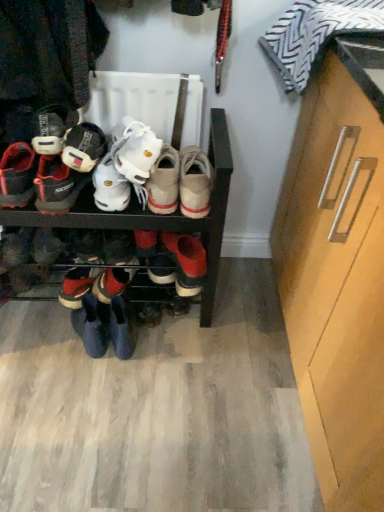
The width and height of the screenshot is (384, 512). What do you see at coordinates (51, 129) in the screenshot? I see `matte black shoe at left, which is counted as the 2th footwear, starting from the left` at bounding box center [51, 129].

The width and height of the screenshot is (384, 512). Describe the element at coordinates (315, 34) in the screenshot. I see `striped fabric pillow at upper right` at that location.

In order to face white suede sneakers at center, acting as the second footwear starting from the right, should I rotate leftwards or rightwards?

Turn left by 3.628 degrees to look at white suede sneakers at center, acting as the second footwear starting from the right.

Describe the element at coordinates (195, 183) in the screenshot. I see `light brown suede shoe at center, the 1th footwear when ordered from right to left` at that location.

Locate an element on the screen. light brown wood cabinet at right is located at coordinates (336, 283).

Image resolution: width=384 pixels, height=512 pixels. In order to click on matte black sneakers at left, arranged as the first footwear when viewed from the left in this screenshot , I will do `click(17, 175)`.

Is light brown suede shoe at center, the 1th footwear when ordered from right to left, facing towards matte black shoe at left, which is counted as the 2th footwear, starting from the left?

No, light brown suede shoe at center, the 1th footwear when ordered from right to left, is not aimed at matte black shoe at left, which is counted as the 2th footwear, starting from the left.

From a real-world perspective, count 2nd footwears downward from the matte black shoe at left, arranged as the 5th footwear when viewed from the right, and point to it. Please provide its 2D coordinates.

[(195, 183)]

Can you confirm if light brown suede shoe at center, the 1th footwear when ordered from right to left, is thinner than matte black shoe at left, arranged as the 5th footwear when viewed from the right?

No, light brown suede shoe at center, the 1th footwear when ordered from right to left, is not thinner than matte black shoe at left, arranged as the 5th footwear when viewed from the right.

From a real-world perspective, who is located lower, light brown suede shoe at center, the 1th footwear when ordered from right to left, or matte black shoe at left, which is counted as the 2th footwear, starting from the left?

light brown suede shoe at center, the 1th footwear when ordered from right to left.

From the image's perspective, which one is positioned lower, light brown wood cabinet at right or black matte shoe rack at center?

light brown wood cabinet at right appears lower in the image.

Is light brown wood cabinet at right positioned beyond the bounds of black matte shoe rack at center?

A: Absolutely, light brown wood cabinet at right is external to black matte shoe rack at center.

Can you confirm if light brown wood cabinet at right is positioned to the right of black matte shoe rack at center?

Correct, you'll find light brown wood cabinet at right to the right of black matte shoe rack at center.

Looking at the image, does matte black shoe at left, arranged as the 5th footwear when viewed from the right, seem bigger or smaller compared to light brown suede shoe at center, the 1th footwear when ordered from right to left?

Considering their sizes, matte black shoe at left, arranged as the 5th footwear when viewed from the right, takes up less space than light brown suede shoe at center, the 1th footwear when ordered from right to left.

Based on their positions, is matte black shoe at left, arranged as the 5th footwear when viewed from the right, located to the left or right of light brown suede shoe at center, positioned as the sixth footwear in left-to-right order?

Clearly, matte black shoe at left, arranged as the 5th footwear when viewed from the right, is on the left of light brown suede shoe at center, positioned as the sixth footwear in left-to-right order, in the image.

Is the depth of matte black shoe at left, arranged as the 5th footwear when viewed from the right, less than that of light brown suede shoe at center, positioned as the sixth footwear in left-to-right order?

Yes, matte black shoe at left, arranged as the 5th footwear when viewed from the right, is closer to the viewer.

Is striped fabric pillow at upper right at the left side of matte black shoe at left, which is counted as the 2th footwear, starting from the left?

Incorrect, striped fabric pillow at upper right is not on the left side of matte black shoe at left, which is counted as the 2th footwear, starting from the left.

From a real-world perspective, between striped fabric pillow at upper right and matte black shoe at left, arranged as the 5th footwear when viewed from the right, who is vertically lower?

matte black shoe at left, arranged as the 5th footwear when viewed from the right.

How different are the orientations of striped fabric pillow at upper right and matte black shoe at left, arranged as the 5th footwear when viewed from the right, in degrees?

92.1 degrees separate the facing orientations of striped fabric pillow at upper right and matte black shoe at left, arranged as the 5th footwear when viewed from the right.

Is striped fabric pillow at upper right oriented away from matte black shoe at left, which is counted as the 2th footwear, starting from the left?

No.

Could you tell me if striped fabric pillow at upper right is facing matte black sneakers at left, which appears as the 6th footwear when viewed from the right?

Yes.

From the image's perspective, is striped fabric pillow at upper right on top of matte black sneakers at left, arranged as the first footwear when viewed from the left?

Indeed, from the image's perspective, striped fabric pillow at upper right is shown above matte black sneakers at left, arranged as the first footwear when viewed from the left.

Looking at this image, how many degrees apart are the facing directions of striped fabric pillow at upper right and matte black sneakers at left, arranged as the first footwear when viewed from the left?

There is a 92.1-degree angle between the facing directions of striped fabric pillow at upper right and matte black sneakers at left, arranged as the first footwear when viewed from the left.

Considering the relative positions of striped fabric pillow at upper right and matte black sneakers at left, arranged as the first footwear when viewed from the left, in the image provided, is striped fabric pillow at upper right to the right of matte black sneakers at left, arranged as the first footwear when viewed from the left, from the viewer's perspective?

Indeed, striped fabric pillow at upper right is positioned on the right side of matte black sneakers at left, arranged as the first footwear when viewed from the left.

In the scene shown: Is matte black shoe at left, arranged as the 5th footwear when viewed from the right, wider than white suede sneakers at center, the fifth footwear from the left?

Incorrect, the width of matte black shoe at left, arranged as the 5th footwear when viewed from the right, does not surpass that of white suede sneakers at center, the fifth footwear from the left.

How many degrees apart are the facing directions of matte black shoe at left, arranged as the 5th footwear when viewed from the right, and white suede sneakers at center, the fifth footwear from the left?

The angle between the facing direction of matte black shoe at left, arranged as the 5th footwear when viewed from the right, and the facing direction of white suede sneakers at center, the fifth footwear from the left, is 0.00141 degrees.

Is matte black shoe at left, arranged as the 5th footwear when viewed from the right, taller or shorter than white suede sneakers at center, acting as the second footwear starting from the right?

Clearly, matte black shoe at left, arranged as the 5th footwear when viewed from the right, is shorter compared to white suede sneakers at center, acting as the second footwear starting from the right.

From the image's perspective, which is below, matte black shoe at left, which is counted as the 2th footwear, starting from the left, or white suede sneakers at center, the fifth footwear from the left?

white suede sneakers at center, the fifth footwear from the left, is shown below in the image.

From a real-world perspective, is shiny black sneakers at lower left, acting as the third footwear starting from the left, located higher than matte black sneakers at left, arranged as the first footwear when viewed from the left?

No, from a real-world perspective, shiny black sneakers at lower left, acting as the third footwear starting from the left, is not on top of matte black sneakers at left, arranged as the first footwear when viewed from the left.

Between point (73, 300) and point (17, 177), which one is positioned in front?

Positioned in front is point (17, 177).

Does shiny black sneakers at lower left, which is the 4th footwear from right to left, have a lesser height compared to matte black sneakers at left, which appears as the 6th footwear when viewed from the right?

No, shiny black sneakers at lower left, which is the 4th footwear from right to left, is not shorter than matte black sneakers at left, which appears as the 6th footwear when viewed from the right.

How much distance is there between shiny black sneakers at lower left, acting as the third footwear starting from the left, and matte black sneakers at left, which appears as the 6th footwear when viewed from the right?

shiny black sneakers at lower left, acting as the third footwear starting from the left, and matte black sneakers at left, which appears as the 6th footwear when viewed from the right, are 13.44 inches apart from each other.

In order to click on footwear that is the 2nd one when counting upward from the light brown suede shoe at center, the 1th footwear when ordered from right to left (from the image's perspective) in this screenshot , I will do `click(51, 129)`.

Locate an element on the screen. The width and height of the screenshot is (384, 512). cabinetry positioned vertically above the black matte shoe rack at center (from a real-world perspective) is located at coordinates (336, 283).

Which object lies further to the anchor point shiny black sneakers at lower left, which is the 4th footwear from right to left, light brown suede shoe at center, the 1th footwear when ordered from right to left, or light brown wood cabinet at right?

light brown wood cabinet at right is further to shiny black sneakers at lower left, which is the 4th footwear from right to left.

Based on their spatial positions, is black matte shoe rack at center or matte black shoe at left, arranged as the 5th footwear when viewed from the right, closer to light brown suede shoe at center, positioned as the sixth footwear in left-to-right order?

The object closer to light brown suede shoe at center, positioned as the sixth footwear in left-to-right order, is black matte shoe rack at center.

Which object lies further to the anchor point white suede sneakers at center, the fifth footwear from the left, light brown suede shoe at center, positioned as the sixth footwear in left-to-right order, or matte black sneakers at left, arranged as the first footwear when viewed from the left?

Among the two, matte black sneakers at left, arranged as the first footwear when viewed from the left, is located further to white suede sneakers at center, the fifth footwear from the left.

When comparing their distances from matte black sneakers at left, which appears as the 6th footwear when viewed from the right, does black matte shoe rack at center or white suede sneakers at center, the fifth footwear from the left, seem further?

white suede sneakers at center, the fifth footwear from the left, is positioned further to the anchor matte black sneakers at left, which appears as the 6th footwear when viewed from the right.

Consider the image. Considering their positions, is light brown suede shoe at center, positioned as the sixth footwear in left-to-right order, positioned further to white leather sneakers at center, which ranks as the 4th footwear in left-to-right order, than light brown wood cabinet at right?

The object further to white leather sneakers at center, which ranks as the 4th footwear in left-to-right order, is light brown wood cabinet at right.

Which object lies nearer to the anchor point striped fabric pillow at upper right, matte black sneakers at left, which appears as the 6th footwear when viewed from the right, or light brown suede shoe at center, the 1th footwear when ordered from right to left?

light brown suede shoe at center, the 1th footwear when ordered from right to left, is positioned closer to the anchor striped fabric pillow at upper right.

Looking at the image, which one is located closer to black matte shoe rack at center, striped fabric pillow at upper right or matte black sneakers at left, arranged as the first footwear when viewed from the left?

matte black sneakers at left, arranged as the first footwear when viewed from the left, lies closer to black matte shoe rack at center than the other object.

When comparing their distances from shiny black sneakers at lower left, which is the 4th footwear from right to left, does matte black sneakers at left, which appears as the 6th footwear when viewed from the right, or light brown wood cabinet at right seem further?

The object further to shiny black sneakers at lower left, which is the 4th footwear from right to left, is light brown wood cabinet at right.

You are a GUI agent. You are given a task and a screenshot of the screen. Output one action in this format:
    pyautogui.click(x=<x>, y=<y>)
    Task: Click on the shelf situated between matte black sneakers at left, which appears as the 6th footwear when viewed from the right, and light brown suede shoe at center, the 1th footwear when ordered from right to left, from left to right
    
    Given the screenshot: What is the action you would take?
    pyautogui.click(x=158, y=216)

This screenshot has height=512, width=384. Identify the location of footwear between matte black sneakers at left, arranged as the first footwear when viewed from the left, and shiny black sneakers at lower left, which is the 4th footwear from right to left, vertically. (57, 185).

At what (x,y) coordinates should I click in order to perform the action: click on clothing between light brown wood cabinet at right and light brown suede shoe at center, the 1th footwear when ordered from right to left, from front to back. Please return your answer as a coordinate pair (x, y). Looking at the image, I should click on (315, 34).

You are a GUI agent. You are given a task and a screenshot of the screen. Output one action in this format:
    pyautogui.click(x=<x>, y=<y>)
    Task: Click on the shelf located between matte black sneakers at left, which appears as the 6th footwear when viewed from the right, and white suede sneakers at center, the fifth footwear from the left, in the left-right direction
    The width and height of the screenshot is (384, 512).
    Given the screenshot: What is the action you would take?
    pyautogui.click(x=158, y=216)